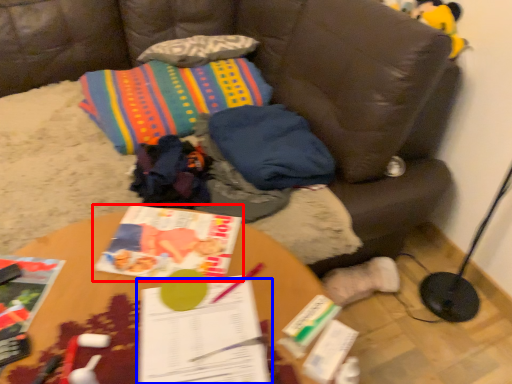
Question: Which of the following is the farthest to the observer, book (highlighted by a red box) or book (highlighted by a blue box)?

Choices:
 (A) book
 (B) book

Answer: (A)